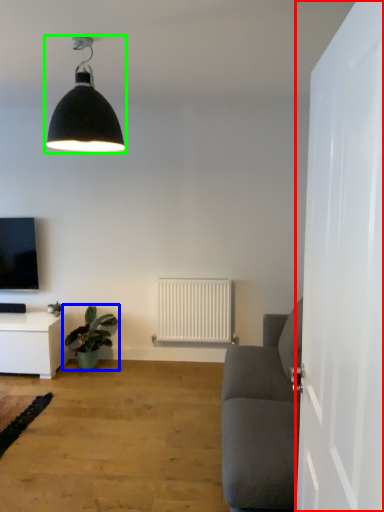
Question: Which object is the farthest from door (highlighted by a red box)? Choose among these: houseplant (highlighted by a blue box) or lamp (highlighted by a green box).

Choices:
 (A) houseplant
 (B) lamp

Answer: (A)